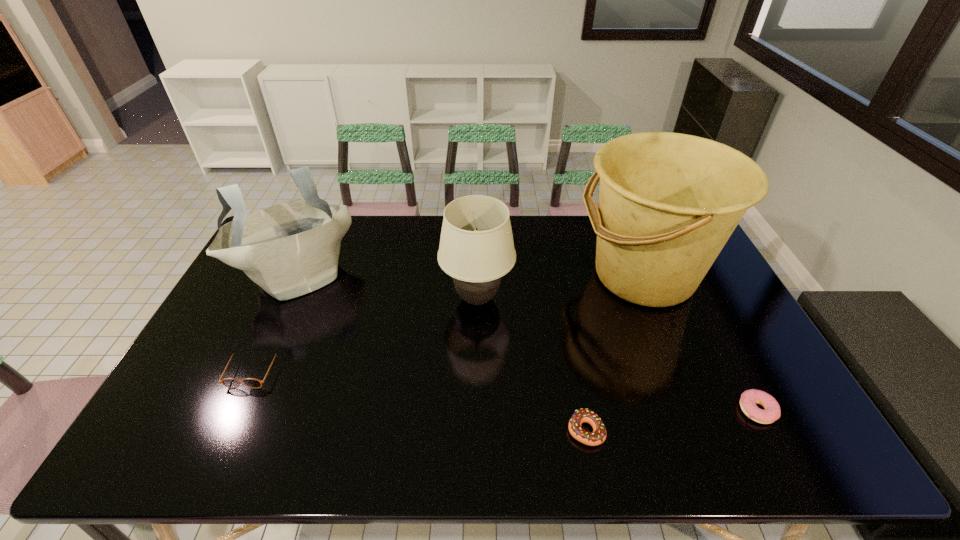
You are a GUI agent. You are given a task and a screenshot of the screen. Output one action in this format:
    pyautogui.click(x=<x>, y=<y>)
    Task: Click on the free region that satisfies the following two spatial constraints: 1. on the front-facing side of the right doughnut; 2. on the left side of the sunglasses
    The height and width of the screenshot is (540, 960).
    Given the screenshot: What is the action you would take?
    pyautogui.click(x=234, y=411)

This screenshot has height=540, width=960. I want to click on vacant space that satisfies the following two spatial constraints: 1. on the side of the bucket with the handle; 2. on the front-facing side of the fourth farthest object, so click(x=683, y=370).

Find the location of `vacant area in the image that satisfies the following two spatial constraints: 1. on the side of the bucket with the handle; 2. on the front side of the third object from right to left`. vacant area in the image that satisfies the following two spatial constraints: 1. on the side of the bucket with the handle; 2. on the front side of the third object from right to left is located at coordinates (708, 430).

Where is `vacant space that satisfies the following two spatial constraints: 1. on the side of the bucket with the handle; 2. on the front-facing side of the third nearest object`? The image size is (960, 540). vacant space that satisfies the following two spatial constraints: 1. on the side of the bucket with the handle; 2. on the front-facing side of the third nearest object is located at coordinates (683, 370).

You are a GUI agent. You are given a task and a screenshot of the screen. Output one action in this format:
    pyautogui.click(x=<x>, y=<y>)
    Task: Click on the vacant area in the image that satisfies the following two spatial constraints: 1. on the front-facing side of the right doughnut; 2. on the left side of the sunglasses
    This screenshot has height=540, width=960.
    Given the screenshot: What is the action you would take?
    pyautogui.click(x=234, y=411)